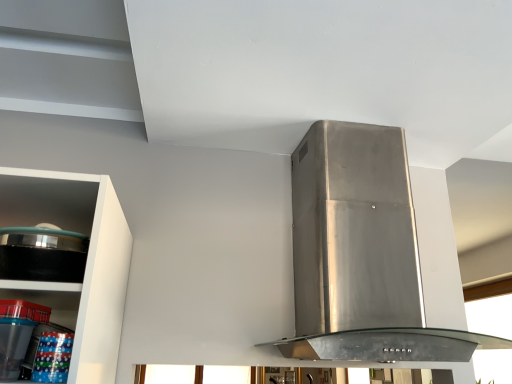
Question: From the image's perspective, does transparent glass window at upper right appear lower than clear plastic containers at lower left?

Choices:
 (A) no
 (B) yes

Answer: (B)

Question: Is transparent glass window at upper right outside of clear plastic containers at lower left?

Choices:
 (A) yes
 (B) no

Answer: (A)

Question: Considering the relative positions of transparent glass window at upper right and clear plastic containers at lower left in the image provided, is transparent glass window at upper right to the right of clear plastic containers at lower left from the viewer's perspective?

Choices:
 (A) no
 (B) yes

Answer: (B)

Question: Are transparent glass window at upper right and clear plastic containers at lower left located far from each other?

Choices:
 (A) yes
 (B) no

Answer: (A)

Question: Can you see transparent glass window at upper right touching clear plastic containers at lower left?

Choices:
 (A) yes
 (B) no

Answer: (B)

Question: Is clear plastic containers at lower left inside the boundaries of stainless steel range hood at center, or outside?

Choices:
 (A) inside
 (B) outside

Answer: (B)

Question: In terms of height, does clear plastic containers at lower left look taller or shorter compared to stainless steel range hood at center?

Choices:
 (A) tall
 (B) short

Answer: (B)

Question: From a real-world perspective, relative to stainless steel range hood at center, is clear plastic containers at lower left vertically above or below?

Choices:
 (A) above
 (B) below

Answer: (B)

Question: From the image's perspective, is clear plastic containers at lower left located above or below stainless steel range hood at center?

Choices:
 (A) below
 (B) above

Answer: (A)

Question: Is point (439, 344) closer or farther from the camera than point (39, 284)?

Choices:
 (A) farther
 (B) closer

Answer: (A)

Question: Looking at the image, does stainless steel range hood at center seem bigger or smaller compared to clear plastic containers at lower left?

Choices:
 (A) big
 (B) small

Answer: (A)

Question: In the image, is stainless steel range hood at center positioned in front of or behind clear plastic containers at lower left?

Choices:
 (A) behind
 (B) front

Answer: (A)

Question: Is stainless steel range hood at center inside or outside of clear plastic containers at lower left?

Choices:
 (A) outside
 (B) inside

Answer: (A)

Question: From the image's perspective, is black glossy pot at left located above or below stainless steel range hood at center?

Choices:
 (A) below
 (B) above

Answer: (B)

Question: In terms of width, does black glossy pot at left look wider or thinner when compared to stainless steel range hood at center?

Choices:
 (A) thin
 (B) wide

Answer: (A)